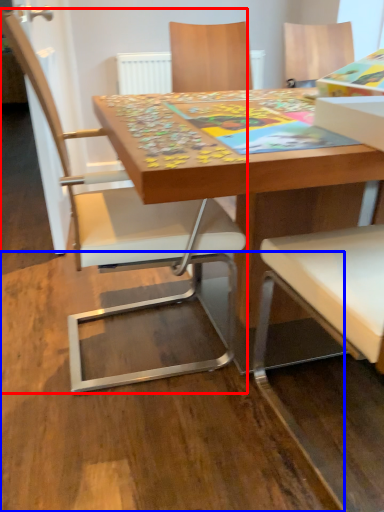
Question: Among these objects, which one is farthest to the camera, chair (highlighted by a red box) or plywood (highlighted by a blue box)?

Choices:
 (A) chair
 (B) plywood

Answer: (A)